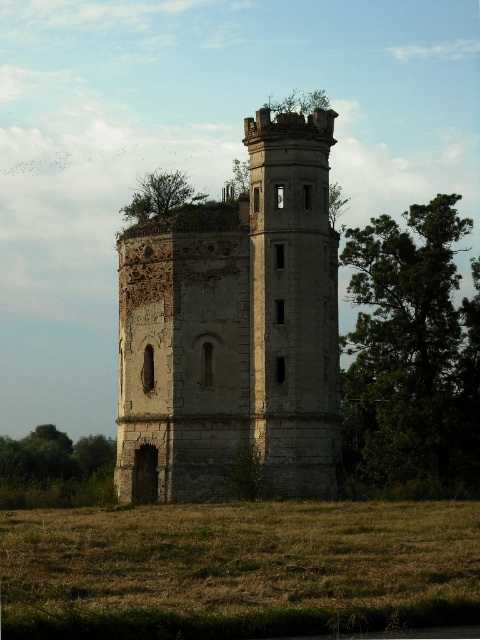
Which is in front, point (282, 321) or point (0, 458)?

Point (282, 321)

Locate an element on the screen. weathered stone tower at center is located at coordinates (235, 330).

Consider the image. Which is below, brown grass at lower center or green leafy tree at lower left?

Positioned lower is green leafy tree at lower left.

Does brown grass at lower center appear on the left side of green leafy tree at lower left?

In fact, brown grass at lower center is to the right of green leafy tree at lower left.

What do you see at coordinates (238, 570) in the screenshot?
I see `brown grass at lower center` at bounding box center [238, 570].

What are the coordinates of `brown grass at lower center` in the screenshot? It's located at (238, 570).

Who is more forward, (x=372, y=460) or (x=72, y=468)?

Positioned in front is point (x=372, y=460).

How far apart are green leafy tree at right and green leafy tree at lower left?

green leafy tree at right is 23.86 meters away from green leafy tree at lower left.

Measure the distance between green leafy tree at right and camera.

green leafy tree at right and camera are 305.04 feet apart.

I want to click on green leafy tree at right, so click(x=411, y=355).